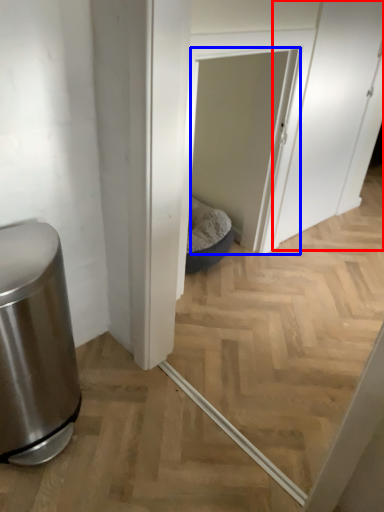
Question: Among these objects, which one is nearest to the camera, screen door (highlighted by a red box) or screen door (highlighted by a blue box)?

Choices:
 (A) screen door
 (B) screen door

Answer: (B)